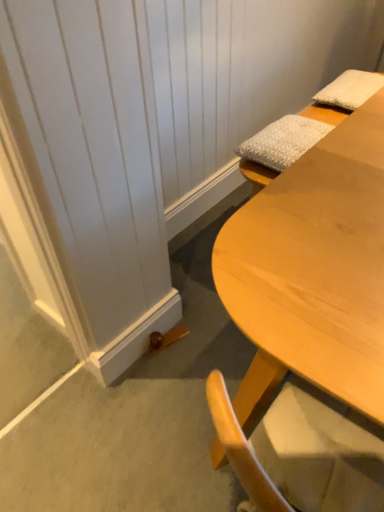
Image resolution: width=384 pixels, height=512 pixels. I want to click on empty space that is ontop of white textured pillow at upper right, arranged as the second pillow when ordered from the bottom (from a real-world perspective), so click(355, 82).